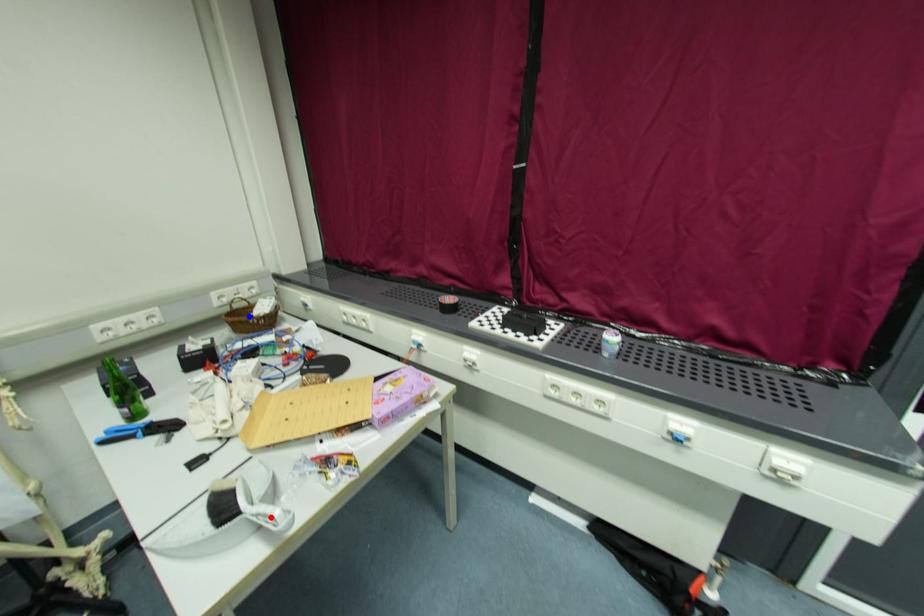
Question: Which of the two points in the image is closer to the camera?

Choices:
 (A) Blue point is closer.
 (B) Red point is closer.

Answer: (B)